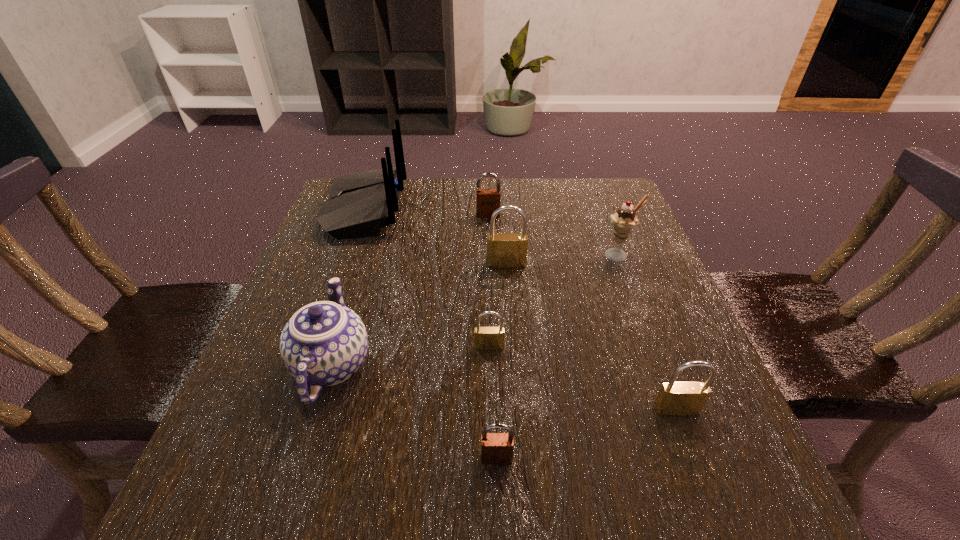
Identify the location of black router. (360, 203).

Identify the location of the tallest object. (360, 203).

This screenshot has width=960, height=540. In order to click on icecream in this screenshot , I will do `click(624, 220)`.

Where is `the tallest padlock`? the tallest padlock is located at coordinates (504, 250).

What are the coordinates of `the farthest brass padlock` in the screenshot? It's located at (504, 250).

This screenshot has width=960, height=540. I want to click on chinaware, so click(324, 343).

The height and width of the screenshot is (540, 960). In order to click on the farthest padlock in this screenshot , I will do `click(487, 200)`.

Where is `the bigger brown padlock`? This screenshot has height=540, width=960. the bigger brown padlock is located at coordinates (487, 200).

I want to click on the second biggest brass padlock, so click(x=675, y=398).

In order to click on the fourth farthest padlock in this screenshot , I will do `click(675, 398)`.